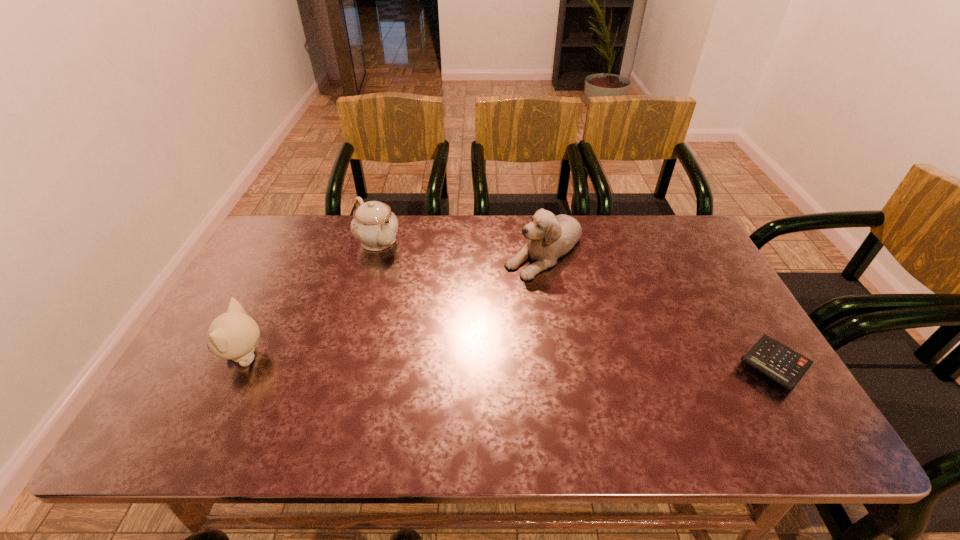
This screenshot has height=540, width=960. What are the coordinates of `object situated at the near right corner` in the screenshot? It's located at (785, 366).

Where is `free location at the far edge of the desktop`? Image resolution: width=960 pixels, height=540 pixels. free location at the far edge of the desktop is located at coordinates (617, 258).

Locate an element on the screen. The height and width of the screenshot is (540, 960). vacant space at the near edge is located at coordinates (578, 381).

Image resolution: width=960 pixels, height=540 pixels. I want to click on free space at the left edge of the desktop, so click(282, 279).

The height and width of the screenshot is (540, 960). In the image, there is a desktop. Find the location of `vacant space at the right edge`. vacant space at the right edge is located at coordinates (729, 374).

In the image, there is a desktop. Where is `vacant space at the far left corner`? vacant space at the far left corner is located at coordinates (271, 234).

Where is `free area in between the chinaware and the kitten`? This screenshot has width=960, height=540. free area in between the chinaware and the kitten is located at coordinates (x=311, y=298).

Image resolution: width=960 pixels, height=540 pixels. I want to click on blank region between the kitten and the shortest object, so tap(509, 361).

Find the location of a particular element. Image resolution: width=960 pixels, height=540 pixels. free space between the second object from right to left and the leftmost object is located at coordinates (395, 302).

This screenshot has height=540, width=960. Identify the location of vacant area that lies between the leftmost object and the calculator. (509, 361).